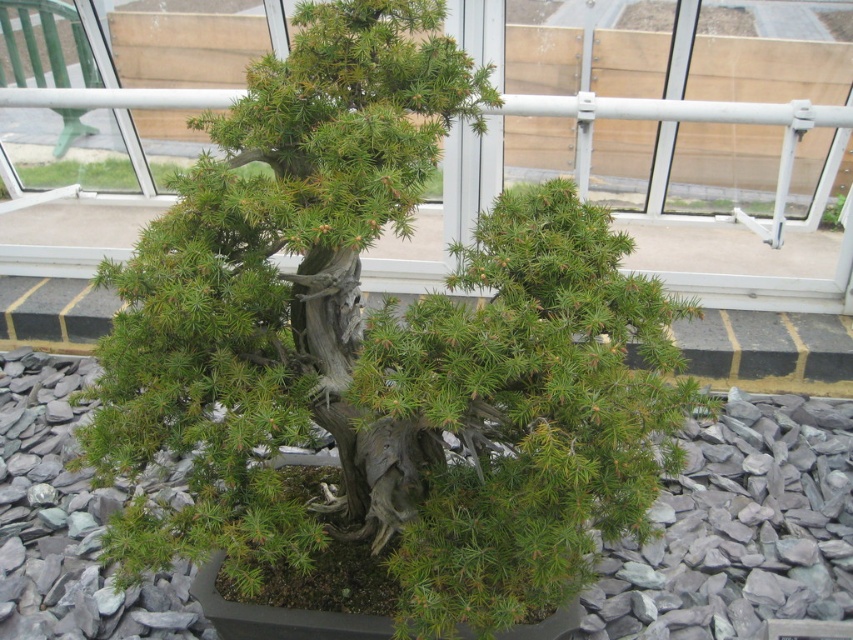
You are a gardener who wants to water the green textured plant at center. You notice there is gray gravel at center in the same area. Which object should you avoid spraying water directly on to prevent overwatering the plant?

You should avoid spraying water directly on the gray gravel at center because it is in front of the green textured plant at center, and directing water at the gravel might cause water to pool and lead to overwatering the plant.

You are a gardener who wants to place a new small statue between the gray gravel at center and the green textured plant at center. Since the statue is 10 cm wide, will it fit in the space between them?

The gray gravel at center has a width larger than the green textured plant at center. However, the exact distance between them isn not specified. Therefore, it is uncertain if the 10 cm wide statue will fit without more information about the spacing between the two objects.

You are a gardener who wants to place a new plant pot exactly at the same location as the gray gravel at center. What coordinates should you use?

The gray gravel at center is located at coordinates point [740,529], so you should place the new plant pot at those coordinates.